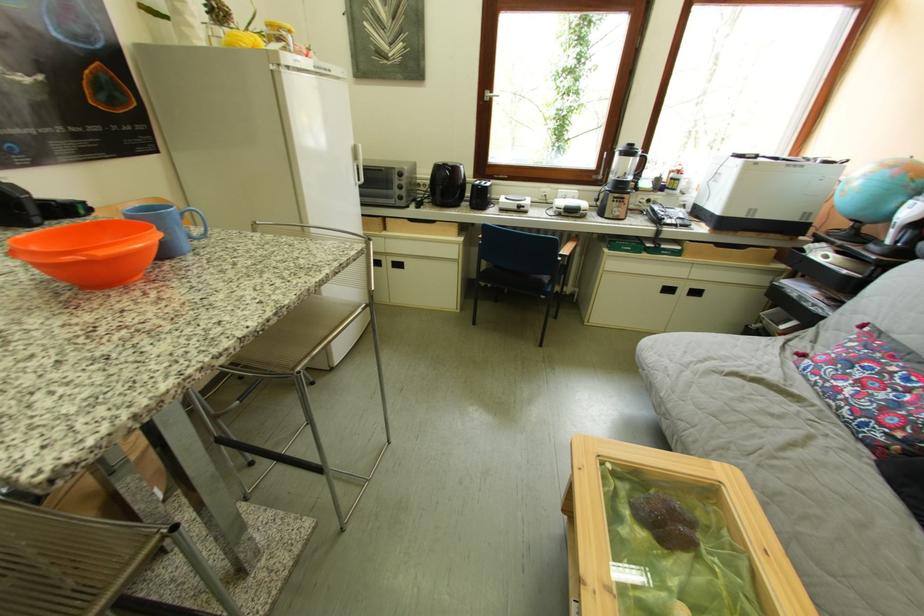
Where would you lift the desk globe? Please return your answer as a coordinate pair (x, y).

(876, 193)